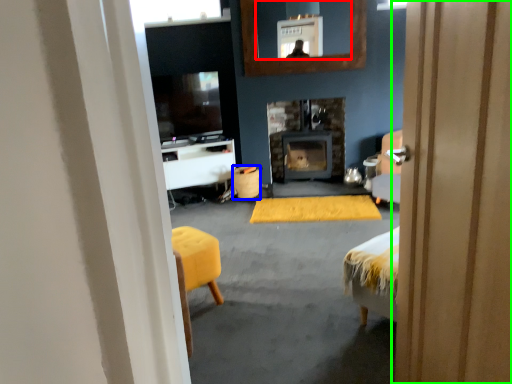
Question: Which object is positioned farthest from mirror (highlighted by a red box)? Select from trash bin/can (highlighted by a blue box) and door (highlighted by a green box).

Choices:
 (A) trash bin/can
 (B) door

Answer: (B)